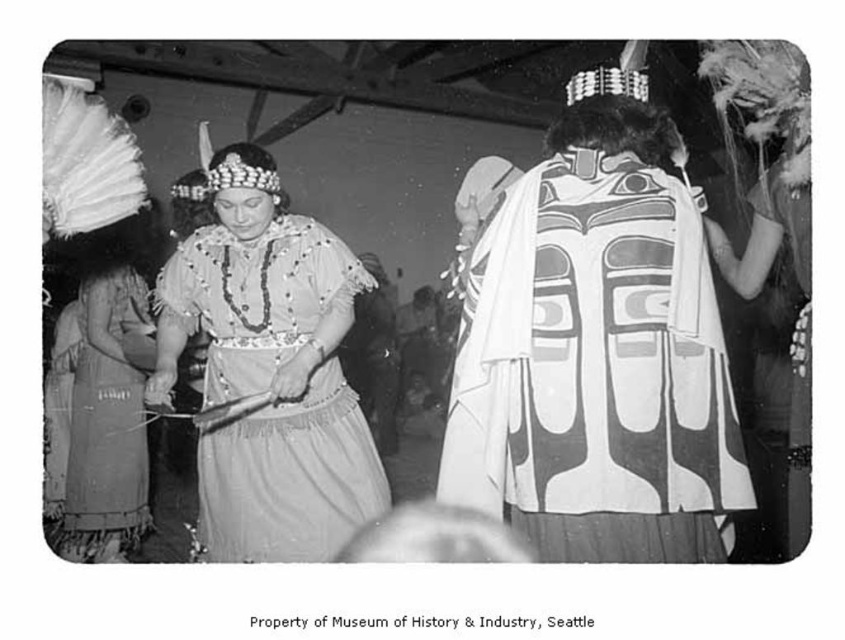
Question: Is white painted wood totem at center positioned behind matte fabric dress at center?

Choices:
 (A) yes
 (B) no

Answer: (B)

Question: Considering the real-world distances, which object is closest to the white painted wood totem at center?

Choices:
 (A) matte fabric dress at center
 (B) textured gray dress at left

Answer: (A)

Question: Is white painted wood totem at center to the left of textured gray dress at left from the viewer's perspective?

Choices:
 (A) yes
 (B) no

Answer: (B)

Question: Which of these objects is positioned closest to the matte fabric dress at center?

Choices:
 (A) white painted wood totem at center
 (B) textured gray dress at left

Answer: (B)

Question: Which is nearer to the matte fabric dress at center?

Choices:
 (A) white painted wood totem at center
 (B) textured gray dress at left

Answer: (B)

Question: Can you confirm if white painted wood totem at center is positioned to the left of matte fabric dress at center?

Choices:
 (A) no
 (B) yes

Answer: (A)